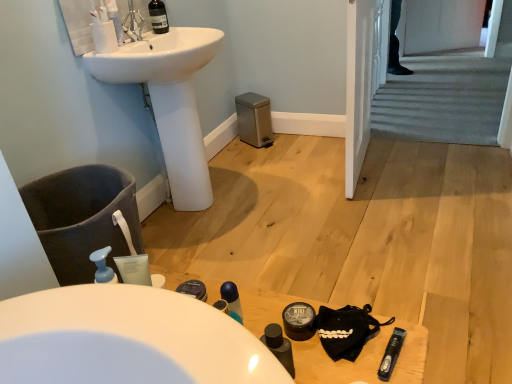
Locate an element on the screen. The height and width of the screenshot is (384, 512). vacant space in between transparent plastic mouthwash at lower right, placed as the third mouthwash when sorted from back to front, and matte black container at lower center is located at coordinates (352, 338).